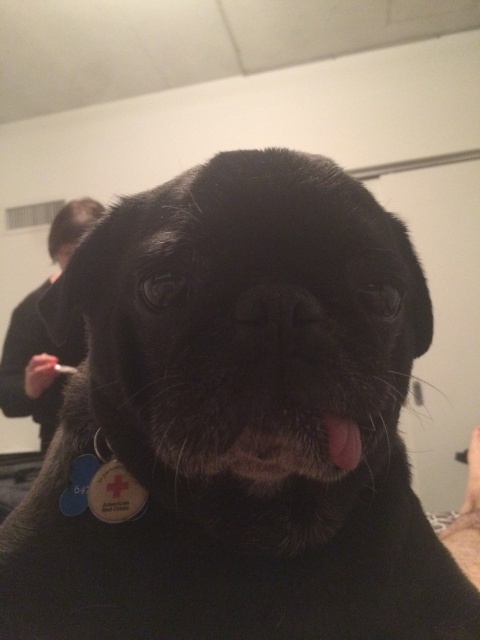
Which is more to the left, black fabric shirt at upper left or pink fur at center?

black fabric shirt at upper left

Does black fabric shirt at upper left come in front of pink fur at center?

No.

I want to click on black fabric shirt at upper left, so click(x=34, y=365).

Image resolution: width=480 pixels, height=640 pixels. I want to click on black fabric shirt at upper left, so click(34, 365).

Is the position of black fabric shirt at upper left more distant than that of black matte nose at center?

Yes, it is.

Is point (54, 253) positioned behind point (297, 310)?

Yes, point (54, 253) is farther from viewer.

This screenshot has height=640, width=480. I want to click on black fabric shirt at upper left, so click(x=34, y=365).

Is pink fur at center smaller than black matte nose at center?

Incorrect, pink fur at center is not smaller in size than black matte nose at center.

Is pink fur at center thinner than black matte nose at center?

No, pink fur at center is not thinner than black matte nose at center.

This screenshot has height=640, width=480. What are the coordinates of `pink fur at center` in the screenshot? It's located at (296, 448).